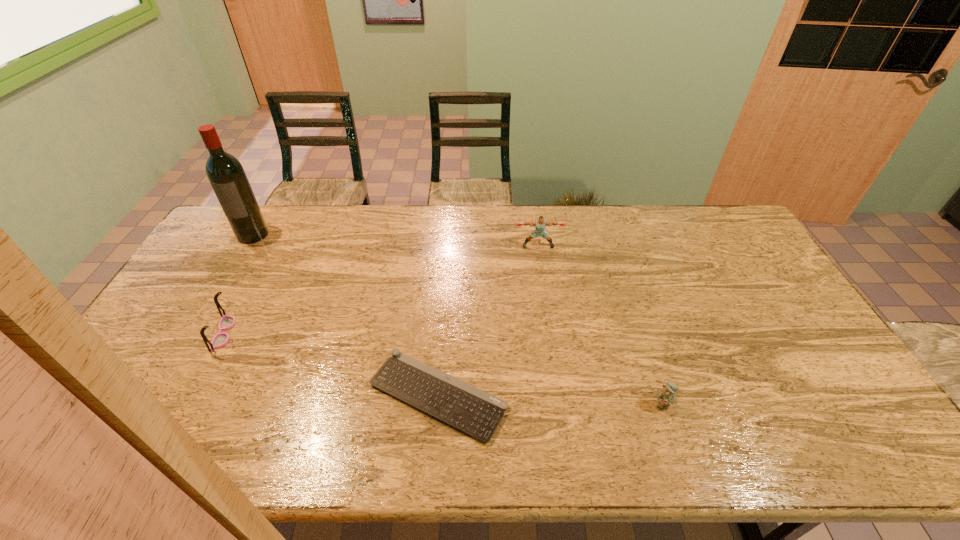
Where is `vacant space located 0.270m on the front-facing side of the puncher`? The height and width of the screenshot is (540, 960). vacant space located 0.270m on the front-facing side of the puncher is located at coordinates (547, 306).

At what (x,y) coordinates should I click in order to perform the action: click on vacant area situated on the left of the spectacles. Please return your answer as a coordinate pair (x, y). This screenshot has width=960, height=540. Looking at the image, I should click on [x=147, y=333].

I want to click on free space located on the front-facing side of the rightmost object, so click(x=675, y=443).

The image size is (960, 540). Identify the location of vacant area situated on the right of the third object from right to left. (593, 395).

At what (x,y) coordinates should I click in order to perform the action: click on wine bottle that is positioned at the far edge. Please return your answer as a coordinate pair (x, y). The height and width of the screenshot is (540, 960). Looking at the image, I should click on (226, 175).

Locate an element on the screen. puncher that is at the far edge is located at coordinates (540, 224).

Find the location of `object that is at the near edge`. object that is at the near edge is located at coordinates (467, 408).

In order to click on object situated at the left edge in this screenshot , I will do `click(226, 175)`.

Where is `object present at the far left corner`? The height and width of the screenshot is (540, 960). object present at the far left corner is located at coordinates (226, 175).

The height and width of the screenshot is (540, 960). I want to click on vacant space at the far edge of the desktop, so click(x=470, y=244).